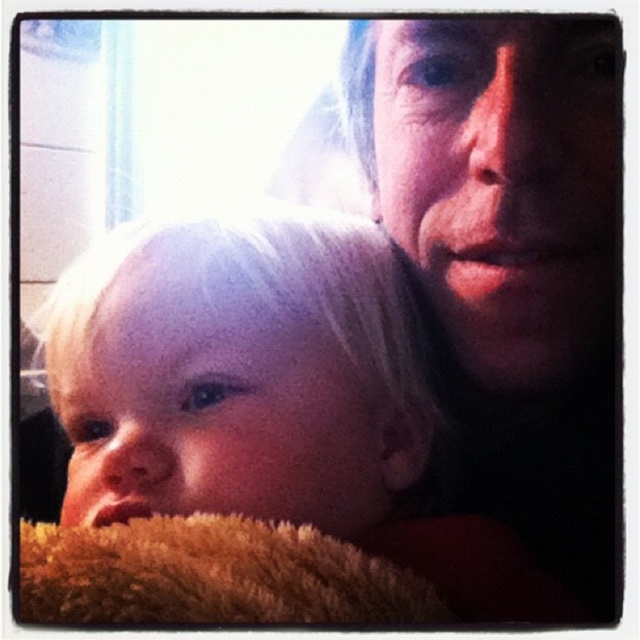
Question: Where is blonde hair at center located in relation to smooth skin face at upper right in the image?

Choices:
 (A) above
 (B) below

Answer: (B)

Question: Among these points, which one is farthest from the camera?

Choices:
 (A) (570, 374)
 (B) (145, 412)

Answer: (A)

Question: Does blonde hair at center have a lesser width compared to smooth skin face at upper right?

Choices:
 (A) no
 (B) yes

Answer: (A)

Question: Does blonde hair at center have a larger size compared to smooth skin face at upper right?

Choices:
 (A) no
 (B) yes

Answer: (B)